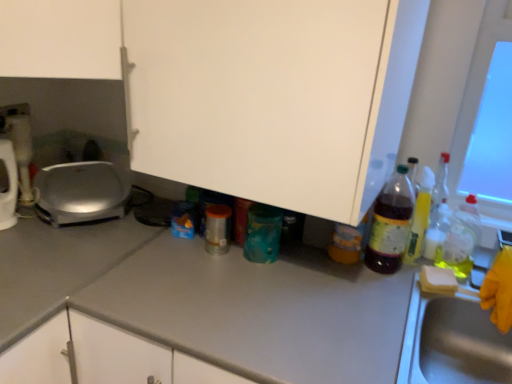
Identify the location of empty space that is in between yellow sponge at right and metallic silver can at center, the fifth bottle viewed from the right. click(332, 268).